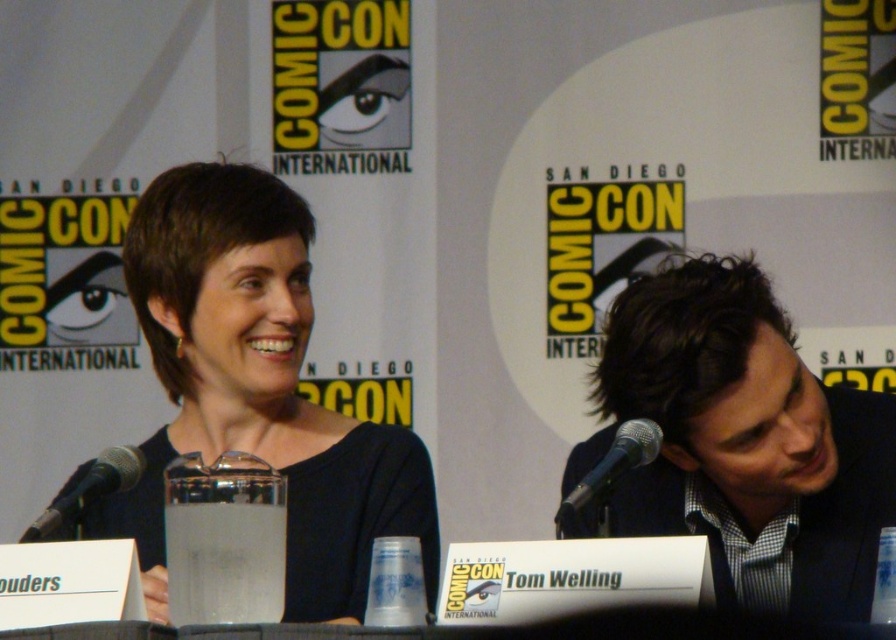
Which is behind, point (784, 428) or point (123, 490)?

Point (123, 490)

Between black textured suit at right and black matte microphone at left, which one is positioned higher?

black textured suit at right

In the scene shown: Who is more forward, (x=728, y=470) or (x=85, y=472)?

Point (x=728, y=470) is more forward.

Image resolution: width=896 pixels, height=640 pixels. Find the location of `black textured suit at right`. black textured suit at right is located at coordinates (743, 442).

Does point (135, 488) come closer to viewer compared to point (675, 396)?

No, it is not.

Is black matte dress at center further to camera compared to black textured suit at right?

Yes, black matte dress at center is further from the viewer.

This screenshot has width=896, height=640. I want to click on black matte dress at center, so tap(257, 388).

The height and width of the screenshot is (640, 896). In order to click on black matte dress at center in this screenshot , I will do `click(257, 388)`.

Who is more forward, (264,403) or (625,436)?

Point (625,436)

Does point (371, 540) lie behind point (619, 428)?

Yes, point (371, 540) is behind point (619, 428).

Is point (294, 595) behind point (564, 504)?

Yes, it is.

Find the location of a particular element. black matte dress at center is located at coordinates (257, 388).